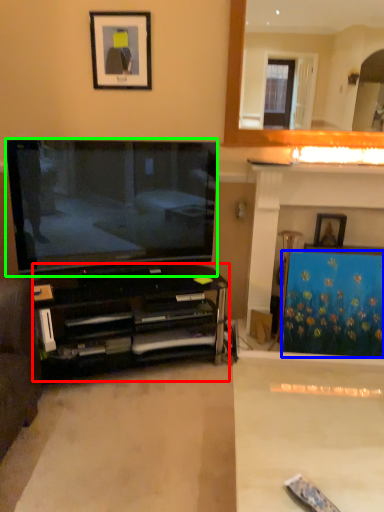
Question: Estimate the real-world distances between objects in this image. Which object is farther from cabinetry (highlighted by a red box), curtain (highlighted by a blue box) or television (highlighted by a green box)?

Choices:
 (A) curtain
 (B) television

Answer: (A)